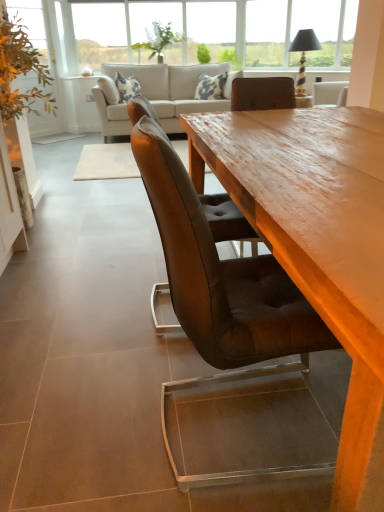
The height and width of the screenshot is (512, 384). Describe the element at coordinates (318, 244) in the screenshot. I see `wooden table at center` at that location.

What are the coordinates of `beige fabric couch at upper center` in the screenshot? It's located at (175, 89).

The image size is (384, 512). Identify the location of green leafy plant at upper center, which is the 2th plant in right-to-left order. (159, 40).

The image size is (384, 512). What do you see at coordinates (159, 40) in the screenshot?
I see `green leafy plant at upper center, which is the 2th plant in right-to-left order` at bounding box center [159, 40].

What is the approximate height of brown leather chair at center?

It is 37.17 inches.

Describe the element at coordinates (225, 219) in the screenshot. I see `brown leather chair at center` at that location.

This screenshot has height=512, width=384. What do you see at coordinates (229, 57) in the screenshot?
I see `green leafy plant at upper center, arranged as the 3th plant when viewed from the left` at bounding box center [229, 57].

Find the location of `wooden table at center`. wooden table at center is located at coordinates (318, 244).

Would you say wooden table at center is to the left or to the right of green leafy plant at upper center, the second plant in the left-to-right sequence, in the picture?

wooden table at center is positioned on green leafy plant at upper center, the second plant in the left-to-right sequence,'s right side.

Is point (349, 305) positioned behind point (153, 34)?

That is False.

Consider the image. Can you confirm if wooden table at center is thinner than green leafy plant at upper center, which is the 2th plant in right-to-left order?

In fact, wooden table at center might be wider than green leafy plant at upper center, which is the 2th plant in right-to-left order.

From the picture: Is matte black lampshade at upper right touching brown leather chair at center?

No, matte black lampshade at upper right is not with brown leather chair at center.

Which of these two, matte black lampshade at upper right or brown leather chair at center, stands taller?

brown leather chair at center.

Is matte black lampshade at upper right facing away from brown leather chair at center?

matte black lampshade at upper right does not have its back to brown leather chair at center.

Considering the relative sizes of green leafy plant at left, marked as the first plant in a left-to-right arrangement, and wooden table at center in the image provided, is green leafy plant at left, marked as the first plant in a left-to-right arrangement, shorter than wooden table at center?

Incorrect, the height of green leafy plant at left, marked as the first plant in a left-to-right arrangement, does not fall short of that of wooden table at center.

Which is in front, green leafy plant at left, which appears as the third plant when viewed from the right, or wooden table at center?

wooden table at center is more forward.

Would you say green leafy plant at left, marked as the first plant in a left-to-right arrangement, is inside or outside wooden table at center?

green leafy plant at left, marked as the first plant in a left-to-right arrangement, is not enclosed by wooden table at center.

Is clear glass window at upper center oriented away from green leafy plant at upper center, which is the 2th plant in right-to-left order?

Absolutely, clear glass window at upper center is directed away from green leafy plant at upper center, which is the 2th plant in right-to-left order.

From a real-world perspective, who is located lower, clear glass window at upper center or green leafy plant at upper center, the second plant in the left-to-right sequence?

green leafy plant at upper center, the second plant in the left-to-right sequence, from a real-world perspective.

Is clear glass window at upper center next to green leafy plant at upper center, the second plant in the left-to-right sequence?

No.

Who is shorter, clear glass window at upper center or green leafy plant at upper center, the second plant in the left-to-right sequence?

green leafy plant at upper center, the second plant in the left-to-right sequence.

Is clear glass window at upper center at the back of beige fabric couch at upper center?

beige fabric couch at upper center is not turned away from clear glass window at upper center.

Would you say beige fabric couch at upper center is inside or outside clear glass window at upper center?

beige fabric couch at upper center is spatially situated outside clear glass window at upper center.

Does beige fabric couch at upper center appear on the right side of clear glass window at upper center?

Yes.

From a real-world perspective, is green leafy plant at left, which appears as the third plant when viewed from the right, below matte black lampshade at upper right?

Yes, from a real-world perspective, green leafy plant at left, which appears as the third plant when viewed from the right, is under matte black lampshade at upper right.

Which is in front, green leafy plant at left, which appears as the third plant when viewed from the right, or matte black lampshade at upper right?

Positioned in front is matte black lampshade at upper right.

Is point (20, 53) less distant than point (305, 46)?

Yes, it is in front of point (305, 46).

How distant is green leafy plant at left, marked as the first plant in a left-to-right arrangement, from matte black lampshade at upper right?

green leafy plant at left, marked as the first plant in a left-to-right arrangement, and matte black lampshade at upper right are 10.32 feet apart.

Consider the image. How different are the orientations of green leafy plant at upper center, arranged as the 3th plant when viewed from the left, and green leafy plant at left, marked as the first plant in a left-to-right arrangement, in degrees?

The angle between the facing direction of green leafy plant at upper center, arranged as the 3th plant when viewed from the left, and the facing direction of green leafy plant at left, marked as the first plant in a left-to-right arrangement, is 46.7 degrees.

Considering the points (219, 59) and (11, 27), which point is in front, point (219, 59) or point (11, 27)?

The point (11, 27) is in front.

Looking at this image, is green leafy plant at upper center, arranged as the 3th plant when viewed from the left, looking in the opposite direction of green leafy plant at left, marked as the first plant in a left-to-right arrangement?

green leafy plant at upper center, arranged as the 3th plant when viewed from the left, is not turned away from green leafy plant at left, marked as the first plant in a left-to-right arrangement.

Locate an element on the screen. coffee table below the green leafy plant at upper center, the second plant in the left-to-right sequence (from a real-world perspective) is located at coordinates (318, 244).

Where is `lamp on the right of brown leather chair at center`? The width and height of the screenshot is (384, 512). lamp on the right of brown leather chair at center is located at coordinates (303, 55).

Which object lies further to the anchor point wooden table at center, green leafy plant at left, which appears as the third plant when viewed from the right, or clear glass window at upper center?

Among the two, clear glass window at upper center is located further to wooden table at center.

From the image, which object appears to be farther from green leafy plant at left, marked as the first plant in a left-to-right arrangement, matte black lampshade at upper right or clear glass window at upper center?

clear glass window at upper center.

Based on their spatial positions, is clear glass window at upper center or brown leather chair at center further from green leafy plant at left, marked as the first plant in a left-to-right arrangement?

clear glass window at upper center.

Based on their spatial positions, is green leafy plant at upper center, arranged as the 3th plant when viewed from the left, or clear glass window at upper center closer to green leafy plant at upper center, the second plant in the left-to-right sequence?

Based on the image, clear glass window at upper center appears to be nearer to green leafy plant at upper center, the second plant in the left-to-right sequence.

From the image, which object appears to be farther from green leafy plant at upper center, arranged as the 3th plant when viewed from the left, brown leather chair at center or green leafy plant at left, which appears as the third plant when viewed from the right?

brown leather chair at center is further to green leafy plant at upper center, arranged as the 3th plant when viewed from the left.

Which object lies further to the anchor point green leafy plant at upper center, the second plant in the left-to-right sequence, green leafy plant at left, which appears as the third plant when viewed from the right, or beige fabric couch at upper center?

green leafy plant at left, which appears as the third plant when viewed from the right, lies further to green leafy plant at upper center, the second plant in the left-to-right sequence, than the other object.

Considering their positions, is clear glass window at upper center positioned further to beige fabric couch at upper center than green leafy plant at upper center, the second plant in the left-to-right sequence?

clear glass window at upper center is further to beige fabric couch at upper center.

When comparing their distances from clear glass window at upper center, does beige fabric couch at upper center or wooden table at center seem further?

Based on the image, wooden table at center appears to be further to clear glass window at upper center.

Find the location of a particular element. studio couch situated between green leafy plant at left, marked as the first plant in a left-to-right arrangement, and matte black lampshade at upper right from left to right is located at coordinates (175, 89).

Where is `studio couch positioned between brown leather chair at center and green leafy plant at left, marked as the first plant in a left-to-right arrangement, from near to far`? The width and height of the screenshot is (384, 512). studio couch positioned between brown leather chair at center and green leafy plant at left, marked as the first plant in a left-to-right arrangement, from near to far is located at coordinates (175, 89).

Locate an element on the screen. The width and height of the screenshot is (384, 512). studio couch located between brown leather chair at center and green leafy plant at upper center, the second plant in the left-to-right sequence, in the depth direction is located at coordinates (175, 89).

I want to click on plant between green leafy plant at left, which appears as the third plant when viewed from the right, and beige fabric couch at upper center from left to right, so click(159, 40).